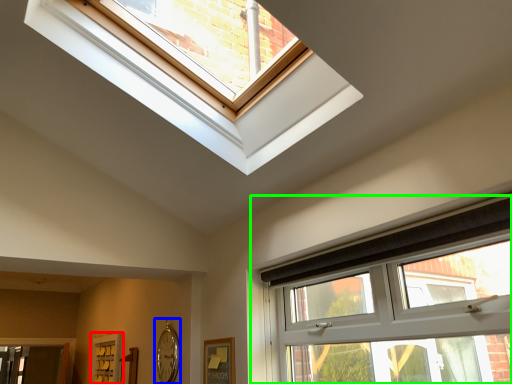
Question: Considering the real-world distances, which object is farthest from screen door (highlighted by a red box)? clock (highlighted by a blue box) or window (highlighted by a green box)?

Choices:
 (A) clock
 (B) window

Answer: (B)